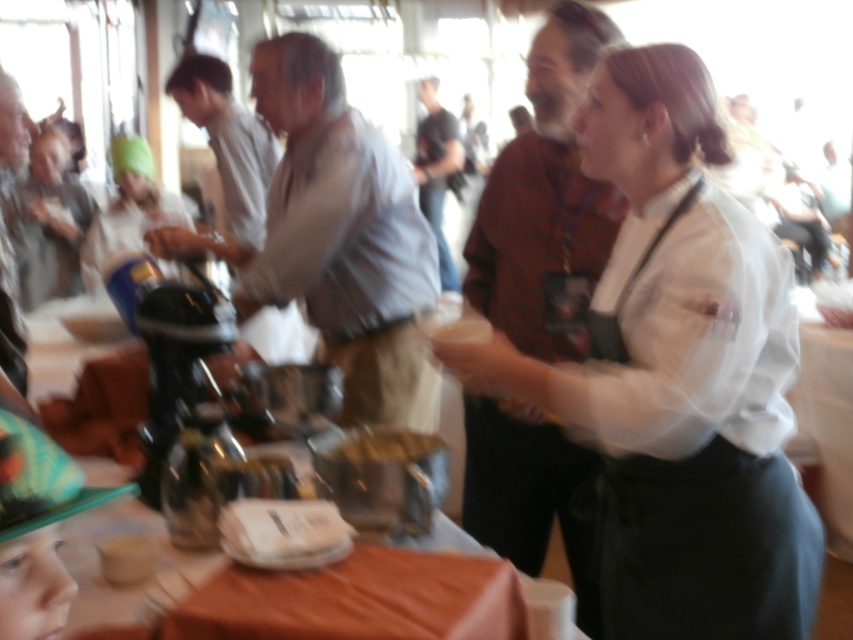
You are a guest at the event and want to place your coat on the nearest available surface. Which object between the orange fabric table at lower center and the matte green hat at upper left would you choose?

The orange fabric table at lower center is the appropriate surface to place your coat since it is a table, while the matte green hat at upper left is likely worn by a person and not suitable for placing items.

Based on the photo, you are a photographer trying to capture a clear shot of the light brown striped shirt at center and the matte green hat at upper left. Since the scene is blurred, you need to adjust your focus. Which object should you focus on first to ensure it appears clearer in the photo?

The light brown striped shirt at center is taller than the matte green hat at upper left, so focusing on the light brown striped shirt at center first would ensure it appears clearer due to its larger size in the frame.